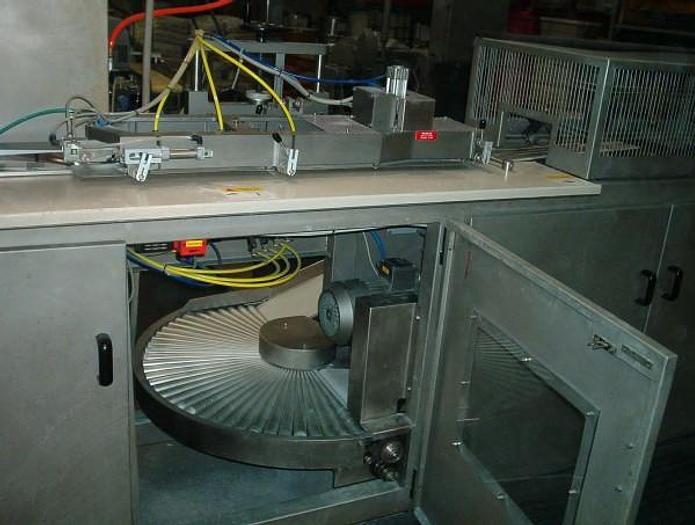
Where is `handle`? This screenshot has height=525, width=695. handle is located at coordinates (101, 359).